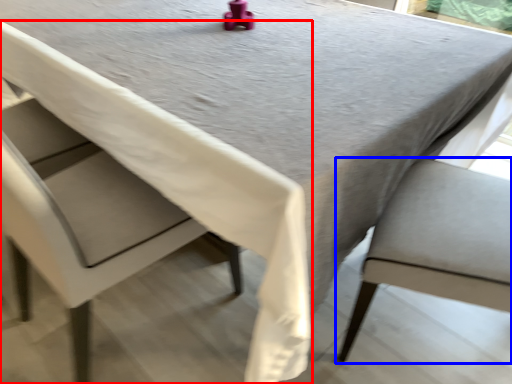
Question: Among these objects, which one is nearest to the camera, chair (highlighted by a red box) or chair (highlighted by a blue box)?

Choices:
 (A) chair
 (B) chair

Answer: (A)